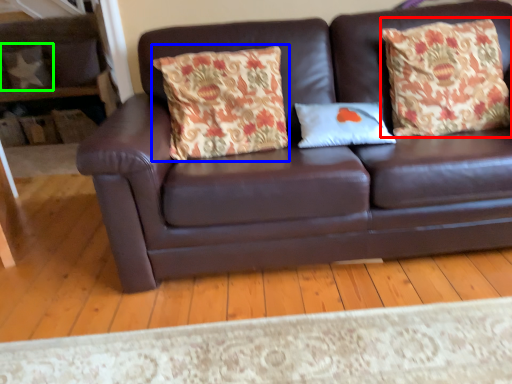
Question: Considering the real-world distances, which object is farthest from throw pillow (highlighted by a red box)? throw pillow (highlighted by a blue box) or pillow (highlighted by a green box)?

Choices:
 (A) throw pillow
 (B) pillow

Answer: (B)